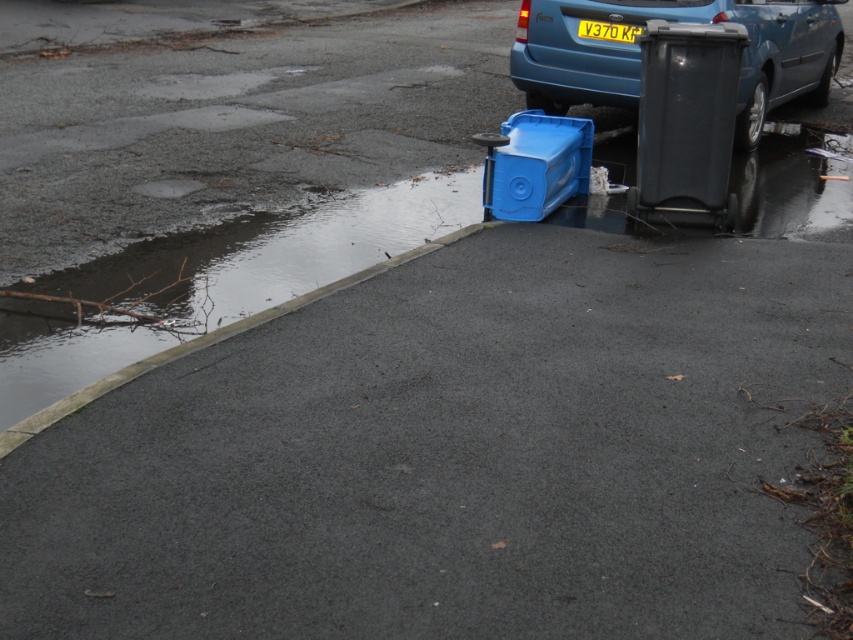
Consider the image. You are a tow truck operator trying to rescue the matte blue car at upper right and the black plastic trash can at right from the flooded road. Which object should you prioritize rescuing first based on their sizes?

The matte blue car at upper right is bigger than the black plastic trash can at right, so you should prioritize rescuing the matte blue car at upper right first because it takes up more space and might be harder to maneuver in the flooded area.

You are a traffic officer assessing an accident scene. You notice the matte blue car at upper right and the yellow matte license plate at upper center. Which object is closer to you from your vantage point?

The matte blue car at upper right is closer to you than the yellow matte license plate at upper center because it is positioned in front of it.